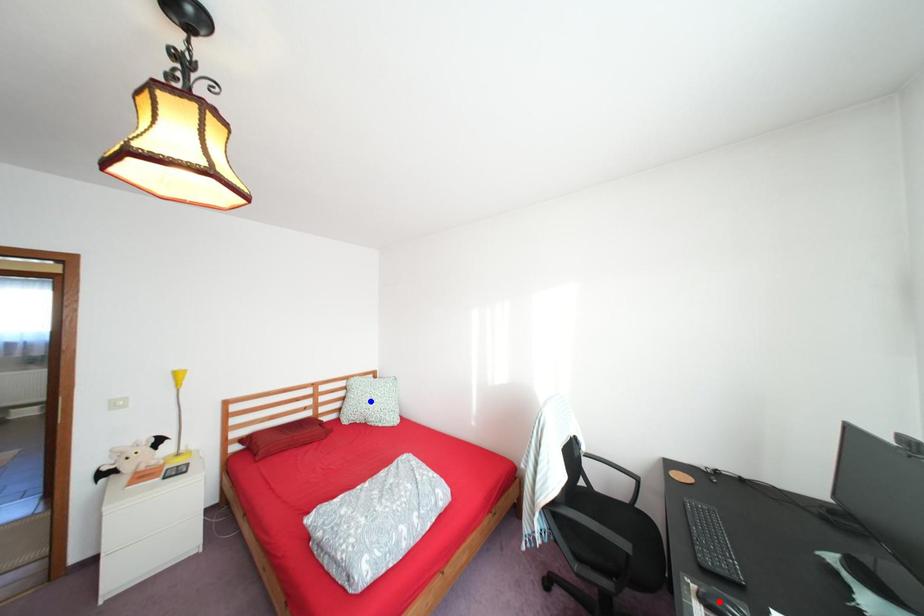
Question: Two points are marked on the image. Which point is closer to the camera?

Choices:
 (A) Blue point is closer.
 (B) Red point is closer.

Answer: (B)